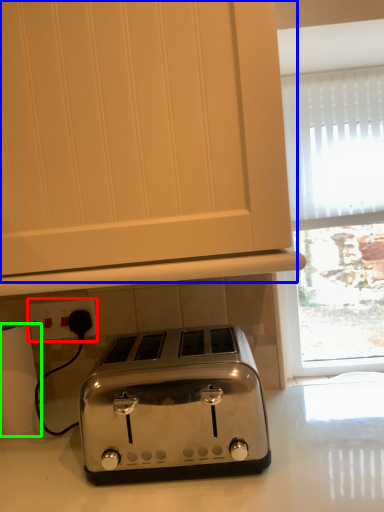
Question: Based on their relative distances, which object is nearer to electric outlet (highlighted by a red box)? Choose from oven (highlighted by a blue box) and toilet paper (highlighted by a green box).

Choices:
 (A) oven
 (B) toilet paper

Answer: (B)